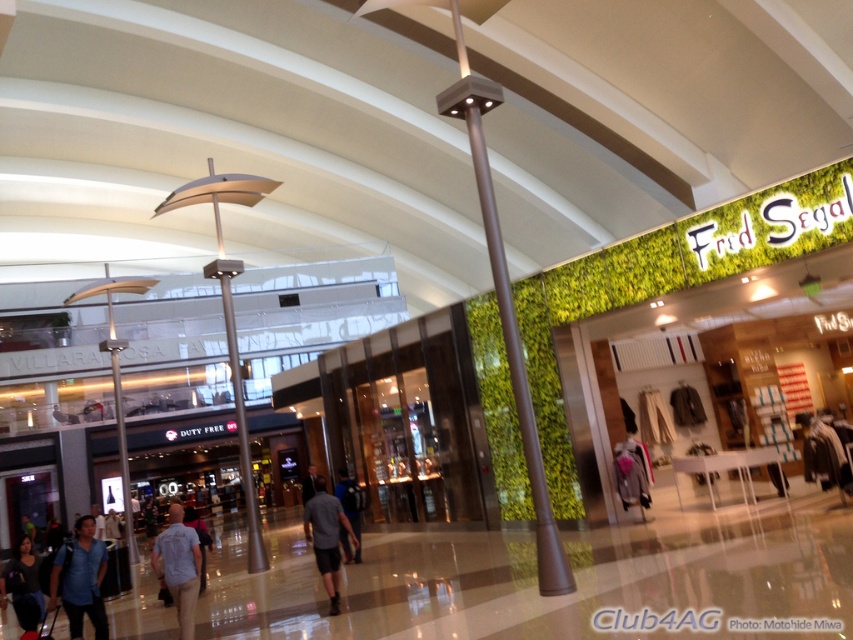
Question: Observing the image, what is the correct spatial positioning of satin silver pole at center in reference to dark blue shirt at lower left?

Choices:
 (A) right
 (B) left

Answer: (A)

Question: Which object is positioned farthest from the satin silver pole at center?

Choices:
 (A) light blue shirt at center
 (B) dark blue shirt at center
 (C) gray fabric shorts at center

Answer: (B)

Question: Observing the image, what is the correct spatial positioning of light blue shirt at center in reference to dark blue shirt at center?

Choices:
 (A) above
 (B) below

Answer: (A)

Question: Which point appears farthest from the camera in this image?

Choices:
 (A) coord(352,560)
 (B) coord(183,625)

Answer: (A)

Question: Which point is closer to the camera taking this photo?

Choices:
 (A) (157, 560)
 (B) (21, 589)
 (C) (90, 564)
 (D) (442, 3)

Answer: (A)

Question: Considering the relative positions of dark blue shirt at lower left and gray fabric shorts at center in the image provided, where is dark blue shirt at lower left located with respect to gray fabric shorts at center?

Choices:
 (A) right
 (B) left

Answer: (B)